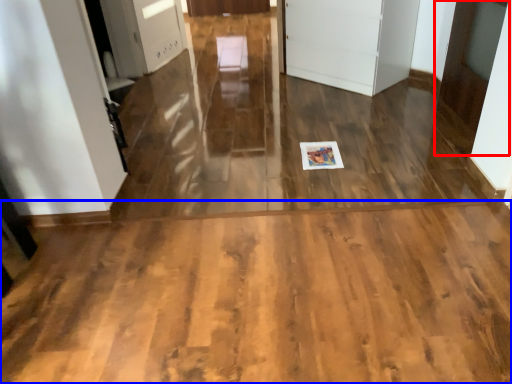
Question: Which object appears farthest to the camera in this image, door (highlighted by a red box) or corridor (highlighted by a blue box)?

Choices:
 (A) door
 (B) corridor

Answer: (A)